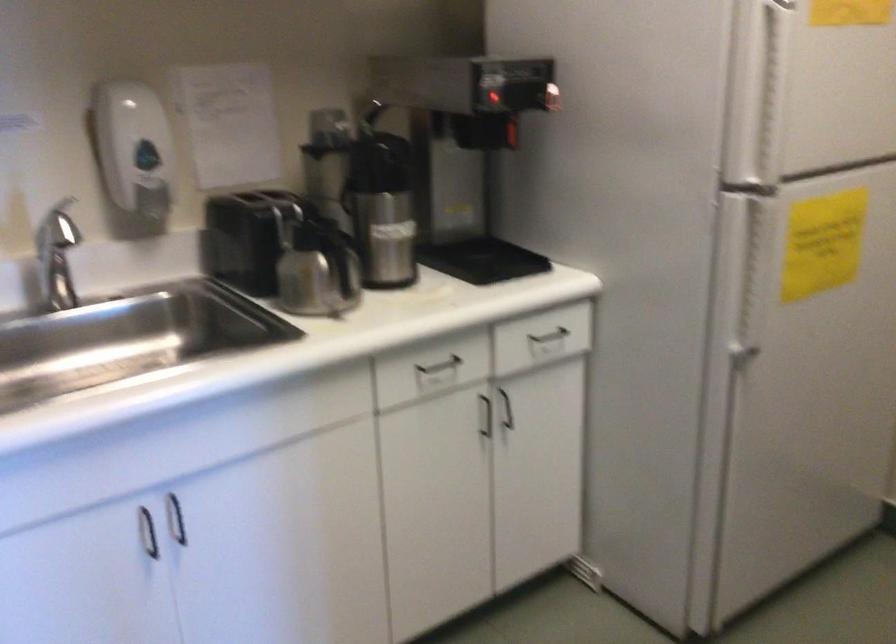
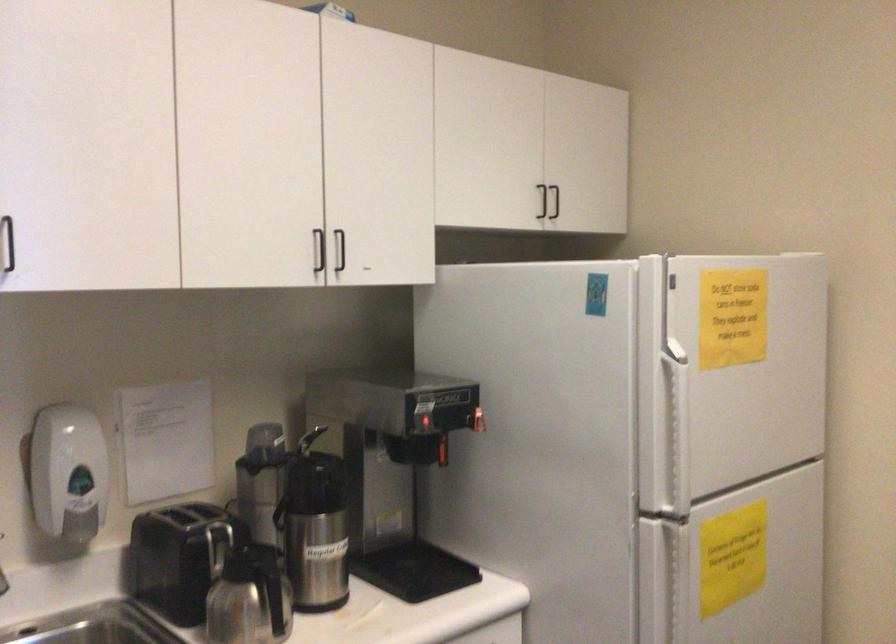
Locate, in the second image, the point that corresponds to (134,149) in the first image.

(67, 473)